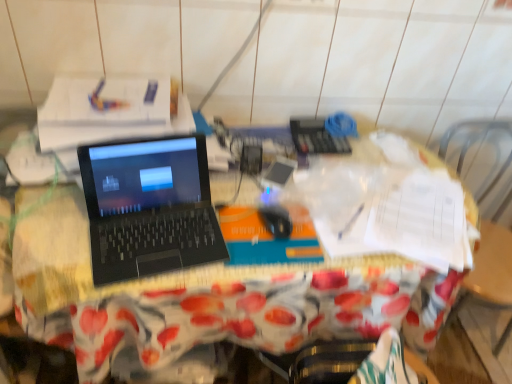
The height and width of the screenshot is (384, 512). I want to click on unoccupied space behind black matte mouse at center, so click(x=281, y=181).